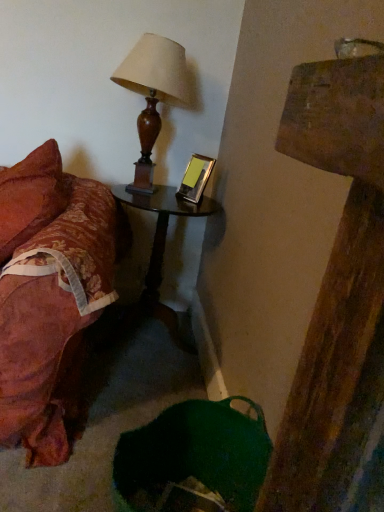
At what (x,y) coordinates should I click in order to perform the action: click on metallic silver picture frame at upper right. Please return your answer as a coordinate pair (x, y). The height and width of the screenshot is (512, 384). Looking at the image, I should click on (196, 178).

Between wooden lampshade at upper left and metallic silver picture frame at upper right, which one appears on the right side from the viewer's perspective?

Positioned to the right is metallic silver picture frame at upper right.

Considering the relative sizes of wooden lampshade at upper left and metallic silver picture frame at upper right in the image provided, is wooden lampshade at upper left taller than metallic silver picture frame at upper right?

Yes, wooden lampshade at upper left is taller than metallic silver picture frame at upper right.

From a real-world perspective, is wooden lampshade at upper left above or below metallic silver picture frame at upper right?

wooden lampshade at upper left is above metallic silver picture frame at upper right.

Is wooden lampshade at upper left behind metallic silver picture frame at upper right?

No, wooden lampshade at upper left is in front of metallic silver picture frame at upper right.

Is wooden lampshade at upper left not close to black glossy nightstand at center?

They are positioned close to each other.

Is point (153, 59) behind point (154, 199)?

No, it is not.

Consider the image. Is wooden lampshade at upper left aimed at black glossy nightstand at center?

No.

Which is behind, wooden lampshade at upper left or black glossy nightstand at center?

Positioned behind is black glossy nightstand at center.

Can you tell me how much metallic silver picture frame at upper right and wooden lampshade at upper left differ in facing direction?

They differ by 55.5 degrees in their facing directions.

Is metallic silver picture frame at upper right far away from wooden lampshade at upper left?

They are positioned close to each other.

Which of these two, metallic silver picture frame at upper right or wooden lampshade at upper left, is smaller?

Smaller between the two is metallic silver picture frame at upper right.

Which object is closer to the camera, metallic silver picture frame at upper right or wooden lampshade at upper left?

wooden lampshade at upper left is in front.

How many degrees apart are the facing directions of black glossy nightstand at center and metallic silver picture frame at upper right?

They differ by 55.5 degrees in their facing directions.

Locate an element on the screen. picture frame to the right of black glossy nightstand at center is located at coordinates (196, 178).

Is black glossy nightstand at center taller or shorter than metallic silver picture frame at upper right?

Clearly, black glossy nightstand at center is taller compared to metallic silver picture frame at upper right.

Is black glossy nightstand at center oriented towards metallic silver picture frame at upper right?

No, black glossy nightstand at center does not turn towards metallic silver picture frame at upper right.

Does metallic silver picture frame at upper right have a lesser height compared to black glossy nightstand at center?

Indeed, metallic silver picture frame at upper right has a lesser height compared to black glossy nightstand at center.

Can you tell me how much metallic silver picture frame at upper right and black glossy nightstand at center differ in facing direction?

There is a 55.5-degree angle between the facing directions of metallic silver picture frame at upper right and black glossy nightstand at center.

I want to click on nightstand on the left of metallic silver picture frame at upper right, so click(162, 226).

From a real-world perspective, is metallic silver picture frame at upper right located beneath black glossy nightstand at center?

No.

From a real-world perspective, which is physically below, black glossy nightstand at center or wooden lampshade at upper left?

black glossy nightstand at center is physically lower.

Relative to wooden lampshade at upper left, is black glossy nightstand at center in front or behind?

Clearly, black glossy nightstand at center is behind wooden lampshade at upper left.

Which is behind, point (157, 238) or point (155, 98)?

Positioned behind is point (157, 238).

Does black glossy nightstand at center have a greater width compared to wooden lampshade at upper left?

Yes.

The image size is (384, 512). Find the location of `picture frame behind the wooden lampshade at upper left`. picture frame behind the wooden lampshade at upper left is located at coordinates (196, 178).

Where is `lamp in front of the black glossy nightstand at center`? lamp in front of the black glossy nightstand at center is located at coordinates (153, 93).

From the image, which object appears to be farther from black glossy nightstand at center, metallic silver picture frame at upper right or wooden lampshade at upper left?

wooden lampshade at upper left lies further to black glossy nightstand at center than the other object.

From the image, which object appears to be nearer to wooden lampshade at upper left, black glossy nightstand at center or metallic silver picture frame at upper right?

metallic silver picture frame at upper right is positioned closer to the anchor wooden lampshade at upper left.

Considering their positions, is wooden lampshade at upper left positioned closer to metallic silver picture frame at upper right than black glossy nightstand at center?

wooden lampshade at upper left is closer to metallic silver picture frame at upper right.

When comparing their distances from black glossy nightstand at center, does wooden lampshade at upper left or metallic silver picture frame at upper right seem further?

The object further to black glossy nightstand at center is wooden lampshade at upper left.

Estimate the real-world distances between objects in this image. Which object is closer to metallic silver picture frame at upper right, black glossy nightstand at center or wooden lampshade at upper left?

Based on the image, wooden lampshade at upper left appears to be nearer to metallic silver picture frame at upper right.

Based on their spatial positions, is metallic silver picture frame at upper right or black glossy nightstand at center closer to wooden lampshade at upper left?

Based on the image, metallic silver picture frame at upper right appears to be nearer to wooden lampshade at upper left.

At what (x,y) coordinates should I click in order to perform the action: click on picture frame between wooden lampshade at upper left and black glossy nightstand at center from top to bottom. Please return your answer as a coordinate pair (x, y). This screenshot has height=512, width=384. Looking at the image, I should click on (196, 178).